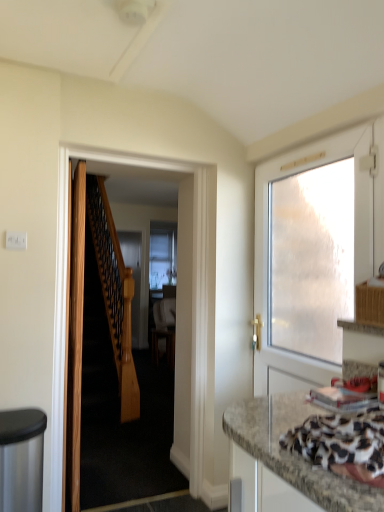
Question: Is white frosted glass door at right, which ranks as the 1th door in right-to-left order, not close to granite-patterned countertop at lower right?

Choices:
 (A) yes
 (B) no

Answer: (B)

Question: Is white frosted glass door at right, which is counted as the 3th door, starting from the left, outside of granite-patterned countertop at lower right?

Choices:
 (A) yes
 (B) no

Answer: (A)

Question: Does white frosted glass door at right, which is counted as the 3th door, starting from the left, turn towards granite-patterned countertop at lower right?

Choices:
 (A) yes
 (B) no

Answer: (B)

Question: Is white frosted glass door at right, which is counted as the 3th door, starting from the left, facing away from granite-patterned countertop at lower right?

Choices:
 (A) no
 (B) yes

Answer: (A)

Question: Does white frosted glass door at right, which ranks as the 1th door in right-to-left order, have a larger size compared to granite-patterned countertop at lower right?

Choices:
 (A) no
 (B) yes

Answer: (B)

Question: Considering the positions of wooden door at center, the second door when ordered from left to right, and wooden door at left, positioned as the 3th door in right-to-left order, in the image, is wooden door at center, the second door when ordered from left to right, bigger or smaller than wooden door at left, positioned as the 3th door in right-to-left order,?

Choices:
 (A) small
 (B) big

Answer: (B)

Question: From a real-world perspective, is wooden door at center, which ranks as the second door in right-to-left order, physically located above or below wooden door at left, positioned as the 3th door in right-to-left order?

Choices:
 (A) below
 (B) above

Answer: (B)

Question: Is wooden door at center, the second door when ordered from left to right, wider or thinner than wooden door at left, positioned as the 3th door in right-to-left order?

Choices:
 (A) thin
 (B) wide

Answer: (A)

Question: Is wooden door at center, the second door when ordered from left to right, inside or outside of wooden door at left, positioned as the 3th door in right-to-left order?

Choices:
 (A) outside
 (B) inside

Answer: (A)

Question: In terms of width, does wooden door at left, which ranks as the first door in left-to-right order, look wider or thinner when compared to white frosted glass door at right, which is counted as the 3th door, starting from the left?

Choices:
 (A) wide
 (B) thin

Answer: (B)

Question: Is wooden door at left, positioned as the 3th door in right-to-left order, spatially inside white frosted glass door at right, which ranks as the 1th door in right-to-left order, or outside of it?

Choices:
 (A) outside
 (B) inside

Answer: (A)

Question: Would you say wooden door at left, which ranks as the first door in left-to-right order, is to the left or to the right of white frosted glass door at right, which is counted as the 3th door, starting from the left, in the picture?

Choices:
 (A) left
 (B) right

Answer: (A)

Question: Considering their positions, is wooden door at left, which ranks as the first door in left-to-right order, located in front of or behind white frosted glass door at right, which ranks as the 1th door in right-to-left order?

Choices:
 (A) behind
 (B) front

Answer: (A)

Question: Based on their sizes in the image, would you say wooden door at left, positioned as the 3th door in right-to-left order, is bigger or smaller than wooden door at center, the second door when ordered from left to right?

Choices:
 (A) small
 (B) big

Answer: (A)

Question: In the image, is wooden door at left, positioned as the 3th door in right-to-left order, positioned in front of or behind wooden door at center, which ranks as the second door in right-to-left order?

Choices:
 (A) behind
 (B) front

Answer: (A)